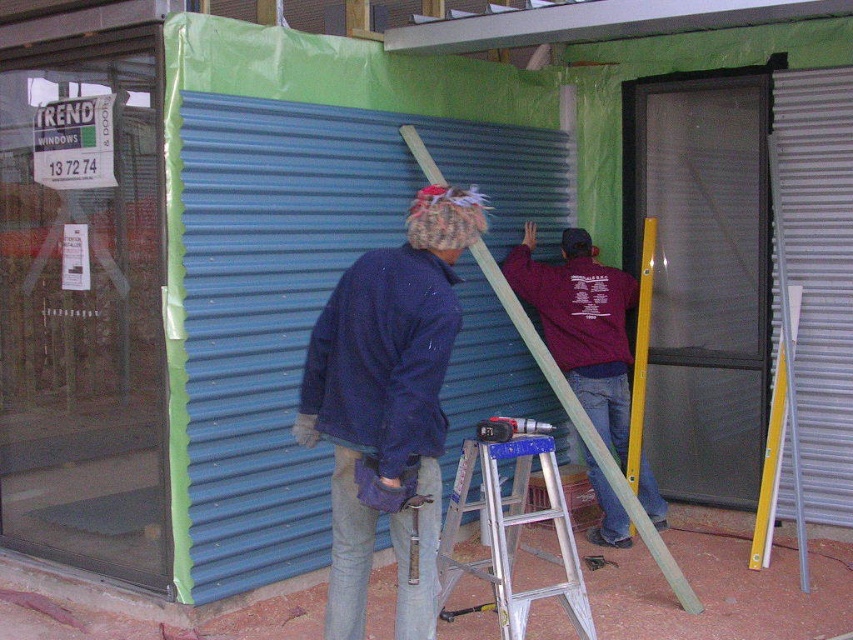
You are an inspector checking the safety of the construction site. You notice the dark blue fabric at center. Where exactly is this fabric positioned in relation to the coordinate system of the image?

The dark blue fabric at center is located at point (x=387, y=403) in the image coordinate system.

You are a contractor assessing the installation of the blue corrugated metal at center and the silver metallic ladder at center. Which object is taller?

The blue corrugated metal at center is taller than the silver metallic ladder at center.